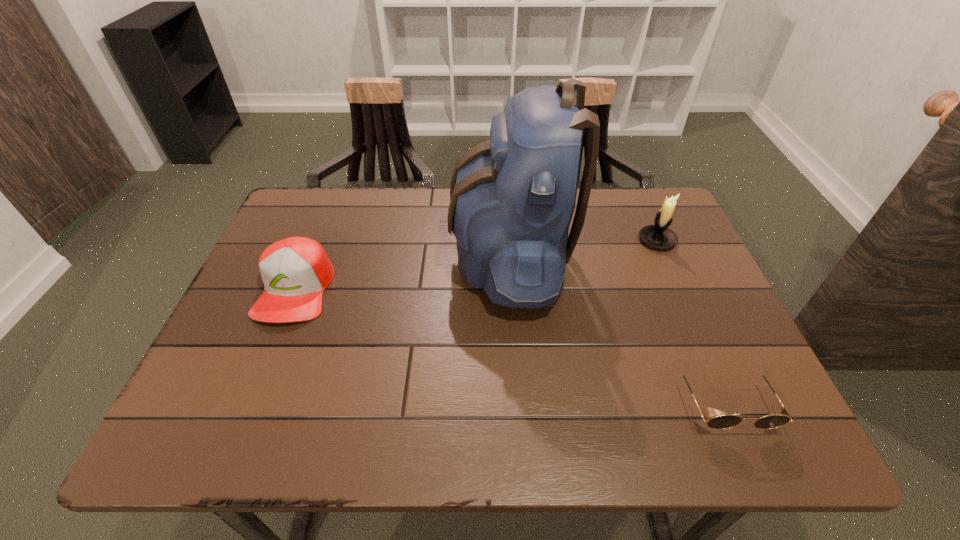
In order to click on vacant space at the far edge in this screenshot , I will do `click(386, 208)`.

In the image, there is a desktop. Where is `vacant area at the near edge`? Image resolution: width=960 pixels, height=540 pixels. vacant area at the near edge is located at coordinates (588, 432).

Where is `free spot at the left edge of the desktop`? The image size is (960, 540). free spot at the left edge of the desktop is located at coordinates coord(231,317).

This screenshot has width=960, height=540. Identify the location of vacant region at the right edge. click(645, 248).

What are the coordinates of `vacant space at the far left corner of the desktop` in the screenshot? It's located at (295, 193).

This screenshot has height=540, width=960. Identify the location of free point at the far right corner. (628, 208).

Where is `empty location between the nearest object and the second shortest object`? This screenshot has width=960, height=540. empty location between the nearest object and the second shortest object is located at coordinates (509, 346).

What are the coordinates of `free space that is in between the backpack and the candle holder` in the screenshot? It's located at (583, 248).

Identify the location of vacant space that is in between the leftmost object and the second object from left to right. The image size is (960, 540). (402, 273).

The width and height of the screenshot is (960, 540). Identify the location of vacant point located between the tallest object and the nearest object. (616, 329).